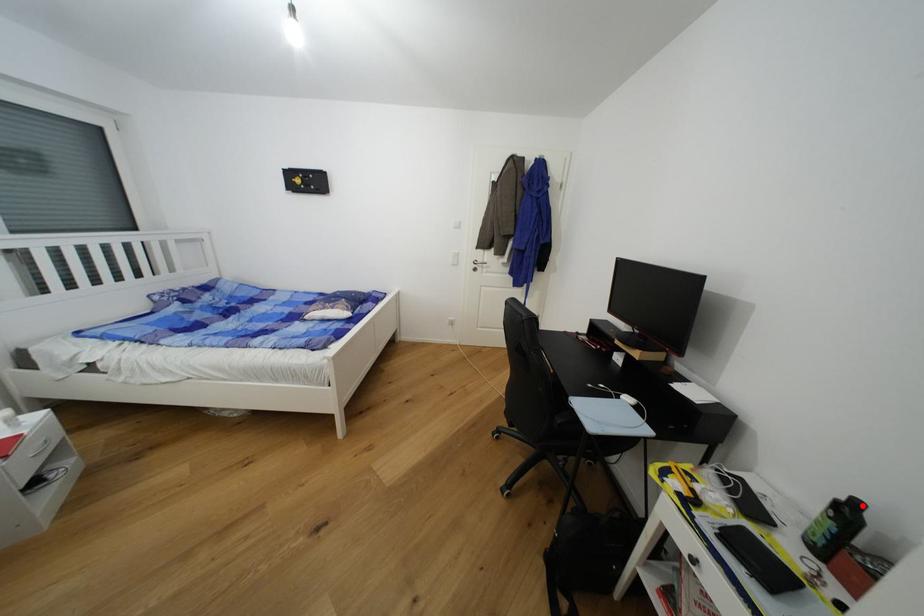
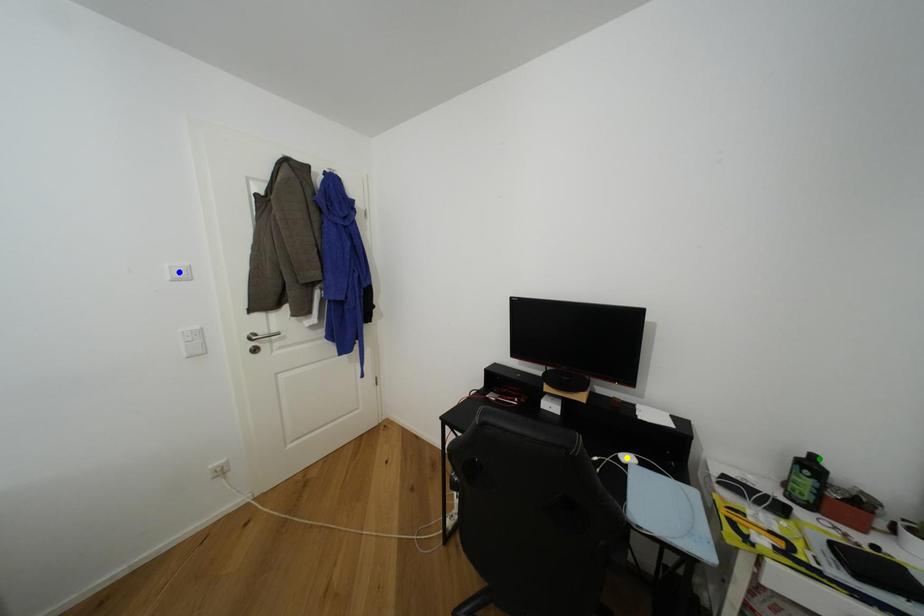
Question: I am providing you with two images of the same scene from different viewpoints. A red point is marked on the first image. You are given multiple points on the second image. Which mark in image 2 goes with the point in image 1?

Choices:
 (A) blue point
 (B) green point
 (C) yellow point

Answer: (B)